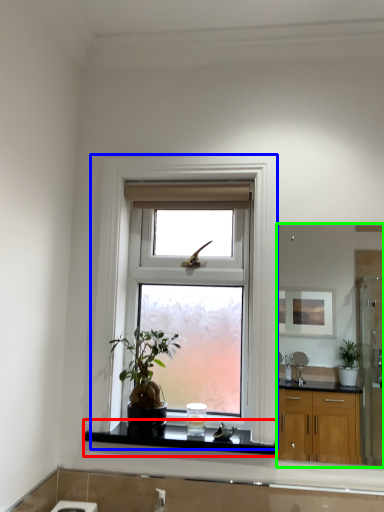
Question: Based on their relative distances, which object is nearer to window sill (highlighted by a red box)? Choose from window (highlighted by a blue box) and mirror (highlighted by a green box).

Choices:
 (A) window
 (B) mirror

Answer: (A)